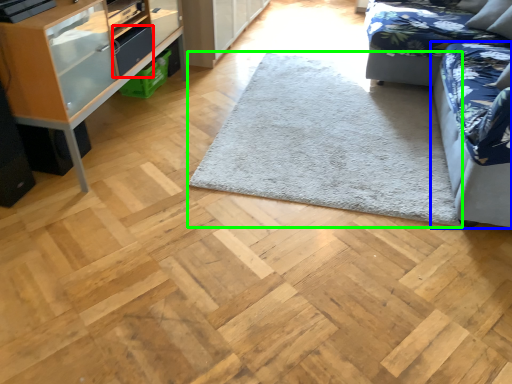
Question: Which object is positioned closest to drawer (highlighted by a red box)? Select from studio couch (highlighted by a blue box) and mat (highlighted by a green box).

Choices:
 (A) studio couch
 (B) mat

Answer: (B)